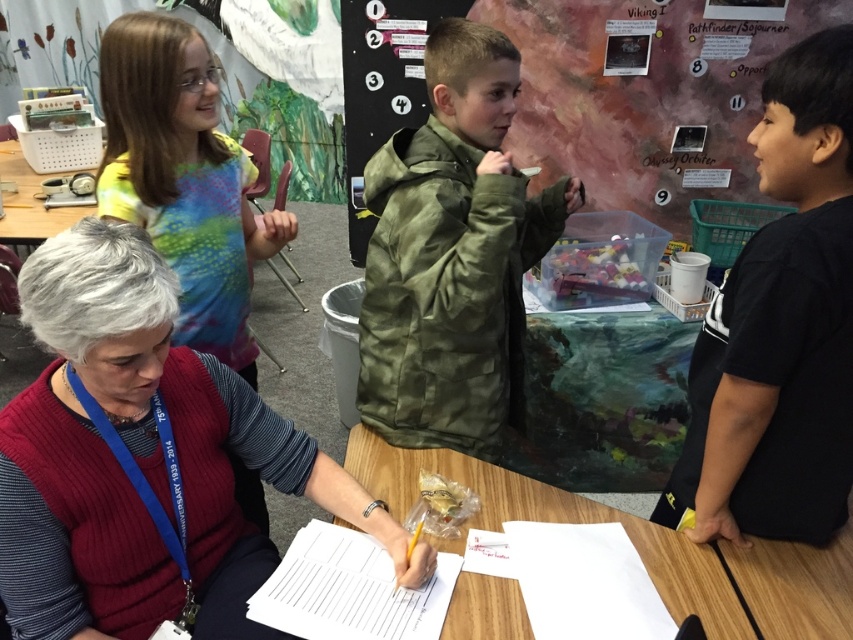
This screenshot has height=640, width=853. I want to click on black matte shirt at right, so click(780, 326).

Describe the element at coordinates (780, 326) in the screenshot. The height and width of the screenshot is (640, 853). I see `black matte shirt at right` at that location.

Identify the location of black matte shirt at right. Image resolution: width=853 pixels, height=640 pixels. (x=780, y=326).

Can you confirm if camouflage jacket at center is positioned to the left of matte plastic table at left?

Incorrect, camouflage jacket at center is not on the left side of matte plastic table at left.

Which is behind, point (485, 179) or point (7, 204)?

The point (7, 204) is behind.

The image size is (853, 640). Identify the location of camouflage jacket at center. (451, 256).

Does point (434, 3) lie in front of point (660, 536)?

No, it is not.

Is matte paperboard at center thinner than wooden table at center?

No.

Is point (555, 173) closer to viewer compared to point (691, 609)?

That is False.

At what (x,y) coordinates should I click in order to perform the action: click on matte paperboard at center. Please return your answer as a coordinate pair (x, y). The height and width of the screenshot is (640, 853). Looking at the image, I should click on (590, 92).